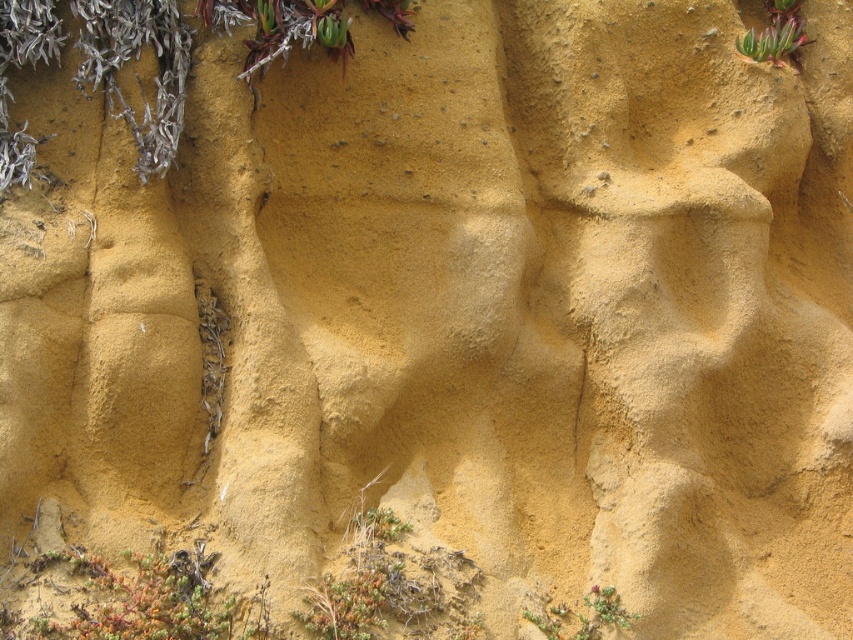
You are a botanist studying the growth patterns of the green succulent at lower left and the green succulent at upper right. Which of these two plants is shorter?

The green succulent at lower left is shorter than the green succulent at upper right.